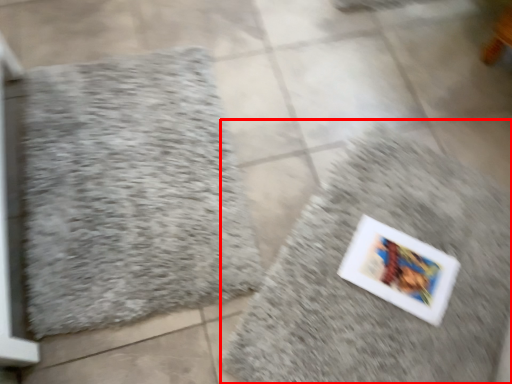
Question: Where is bath mat (annotated by the red box) located in relation to bath mat in the image?

Choices:
 (A) right
 (B) left

Answer: (A)